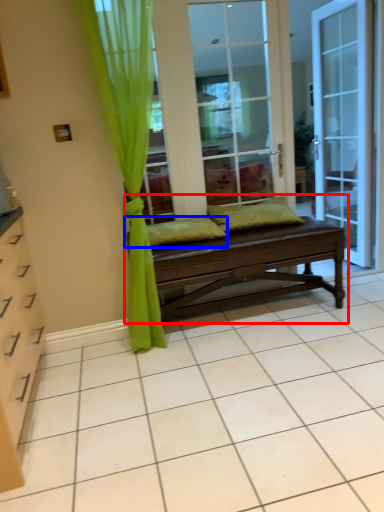
Question: Which object appears farthest to the camera in this image, studio couch (highlighted by a red box) or pillow (highlighted by a blue box)?

Choices:
 (A) studio couch
 (B) pillow

Answer: (B)